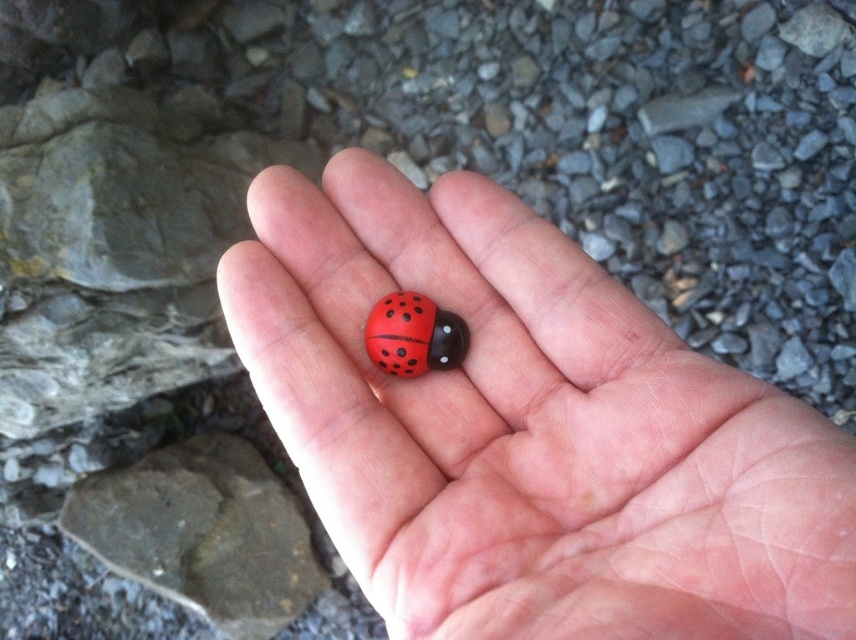
Is point (174, 541) farther from camera compared to point (409, 310)?

That is True.

Measure the distance between point (129,536) and camera.

Point (129,536) and camera are 4.66 feet apart.

Where is `smooth gray rock at lower left`? The image size is (856, 640). smooth gray rock at lower left is located at coordinates (201, 532).

Which is behind, point (830, 500) or point (375, 333)?

Point (375, 333)

Between matte plastic ladybug at center and matte plastic ladybird at center, which one appears on the left side from the viewer's perspective?

matte plastic ladybird at center

Does point (615, 586) lie in front of point (385, 314)?

That is True.

At what (x,y) coordinates should I click in order to perform the action: click on matte plastic ladybug at center. Please return your answer as a coordinate pair (x, y). This screenshot has width=856, height=640. Looking at the image, I should click on (528, 429).

Can you confirm if matte plastic ladybug at center is positioned to the left of smooth gray rock at lower left?

No, matte plastic ladybug at center is not to the left of smooth gray rock at lower left.

Is matte plastic ladybug at center bigger than smooth gray rock at lower left?

Yes.

Who is more forward, (843, 582) or (248, 600)?

Point (843, 582) is more forward.

The image size is (856, 640). I want to click on matte plastic ladybug at center, so click(528, 429).